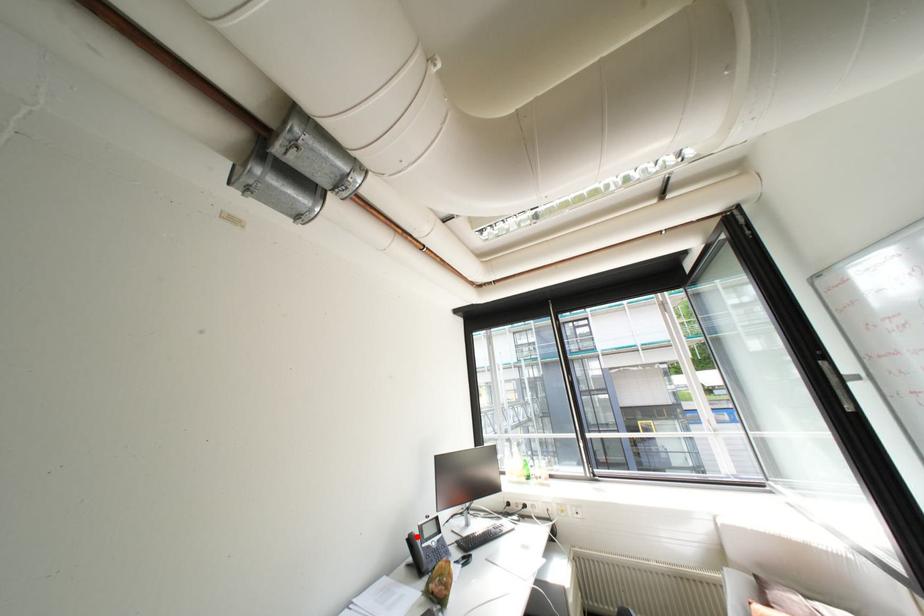
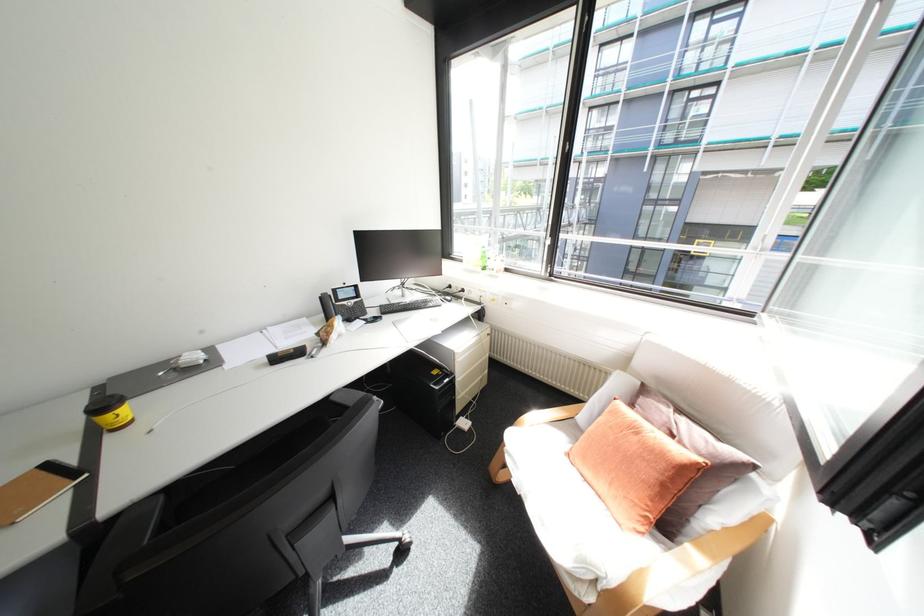
The point at the highlighted location is marked in the first image. Where is the corresponding point in the second image?

(330, 296)